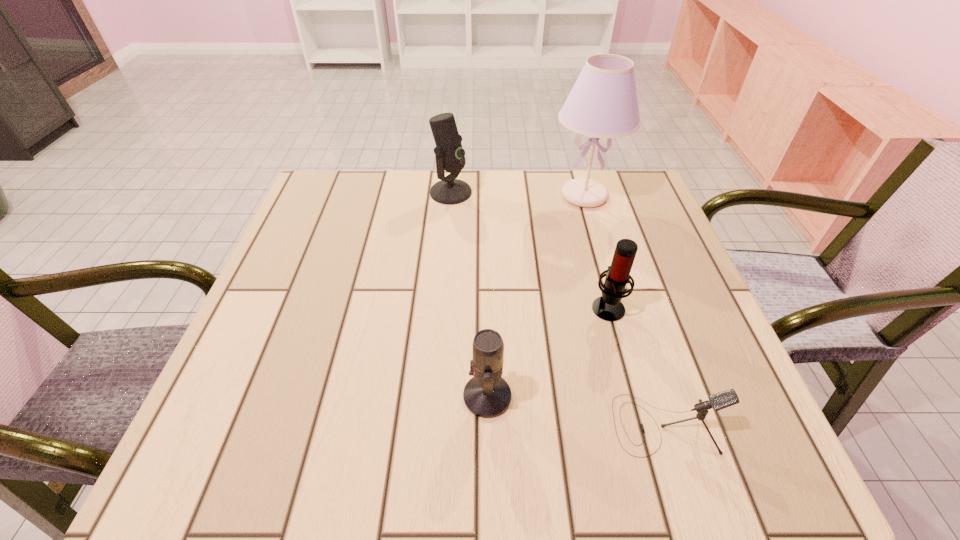
This screenshot has width=960, height=540. Identify the location of free space located 0.370m on the stand of the shortest microphone. (384, 424).

Identify the location of lampshade that is at the far edge. (603, 103).

Image resolution: width=960 pixels, height=540 pixels. Identify the location of microphone that is at the far edge. (450, 156).

The width and height of the screenshot is (960, 540). Find the location of `object that is at the near edge`. object that is at the near edge is located at coordinates (721, 400).

Locate an element on the screen. lampshade at the right edge is located at coordinates (x=603, y=103).

Locate an element on the screen. The width and height of the screenshot is (960, 540). object that is positioned at the far right corner is located at coordinates (603, 103).

In order to click on object positioned at the near right corner in this screenshot , I will do `click(721, 400)`.

Find the location of a particular element. Image resolution: width=960 pixels, height=540 pixels. free space at the far edge of the desktop is located at coordinates (434, 173).

Image resolution: width=960 pixels, height=540 pixels. In the image, there is a desktop. In order to click on free space at the near edge in this screenshot , I will do `click(519, 424)`.

This screenshot has width=960, height=540. In order to click on free space at the left edge in this screenshot , I will do `click(303, 249)`.